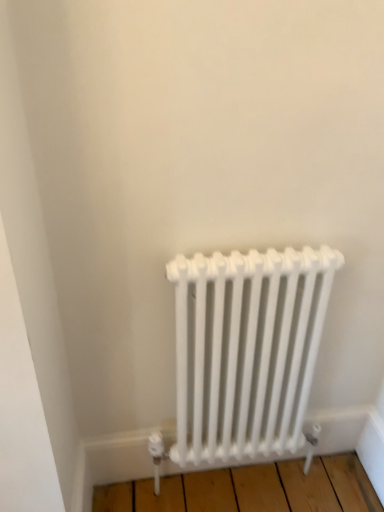
In order to face white metal radiator at center, should I rotate leftwards or rightwards?

To face it directly, rotate right by 7.275 degrees.

Locate an element on the screen. white metal radiator at center is located at coordinates (247, 349).

Describe the element at coordinates (247, 349) in the screenshot. This screenshot has height=512, width=384. I see `white metal radiator at center` at that location.

Where is `white metal radiator at center`? This screenshot has height=512, width=384. white metal radiator at center is located at coordinates (247, 349).